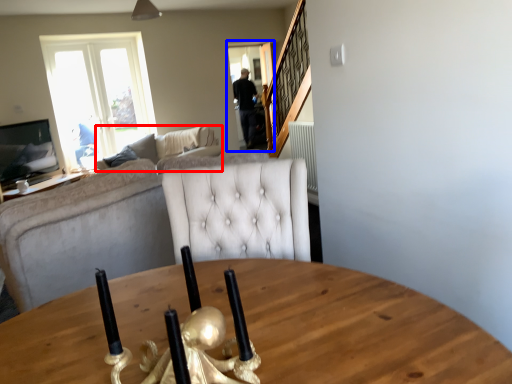
Question: Which object appears farthest to the camera in this image, studio couch (highlighted by a red box) or glass door (highlighted by a blue box)?

Choices:
 (A) studio couch
 (B) glass door

Answer: (B)